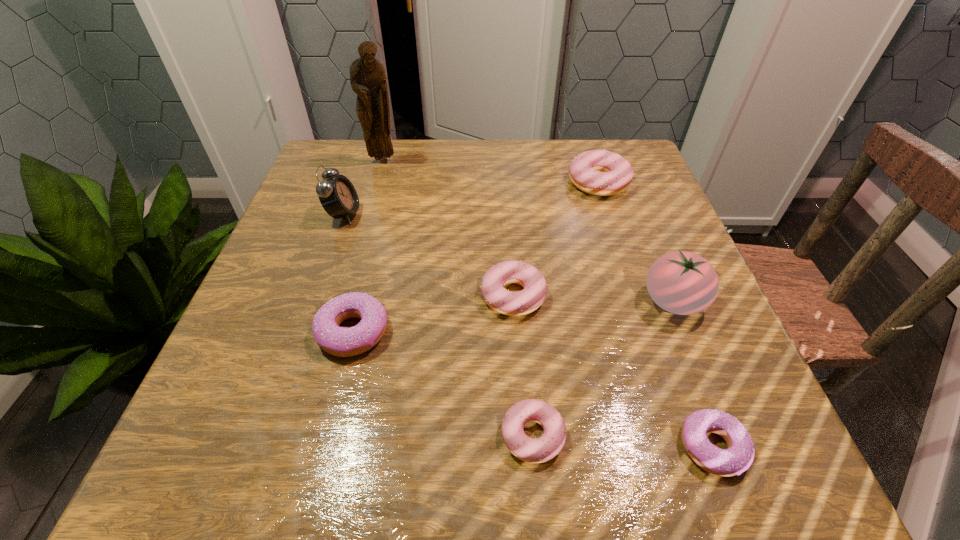
Identify the location of vacant space that's between the figurine and the red tomato. The height and width of the screenshot is (540, 960). (528, 231).

Where is `free space between the left purple doughnut and the biggest pink doughnut`? This screenshot has height=540, width=960. free space between the left purple doughnut and the biggest pink doughnut is located at coordinates (476, 256).

Locate an element on the screen. This screenshot has width=960, height=540. vacant space that's between the second farthest pink doughnut and the nearest pink doughnut is located at coordinates (522, 365).

Identify the location of vacant space that's between the smallest pink doughnut and the fourth tallest object. (565, 308).

At what (x,y) coordinates should I click in order to perform the action: click on free space between the nearest pink doughnut and the tallest object. Please return your answer as a coordinate pair (x, y). The image size is (960, 540). Looking at the image, I should click on (458, 298).

Identify which object is located as the seventh nearest to the third farthest object. Please provide its 2D coordinates. Your answer should be formatted as a tuple, i.e. [(x, y)], where the tuple contains the x and y coordinates of a point satisfying the conditions above.

[(739, 456)]

Identify the location of the fifth closest object relative to the second smallest pink doughnut. The height and width of the screenshot is (540, 960). (598, 172).

Where is `doughnut that is the closest to the leftmost doughnut`? This screenshot has height=540, width=960. doughnut that is the closest to the leftmost doughnut is located at coordinates (x=506, y=302).

Where is `doughnut that stands as the third closest to the fifth shortest object`? Image resolution: width=960 pixels, height=540 pixels. doughnut that stands as the third closest to the fifth shortest object is located at coordinates (534, 450).

At what (x,y) coordinates should I click in order to perform the action: click on the closest pink doughnut relative to the smallest pink doughnut. Please return your answer as a coordinate pair (x, y). Image resolution: width=960 pixels, height=540 pixels. Looking at the image, I should click on (506, 302).